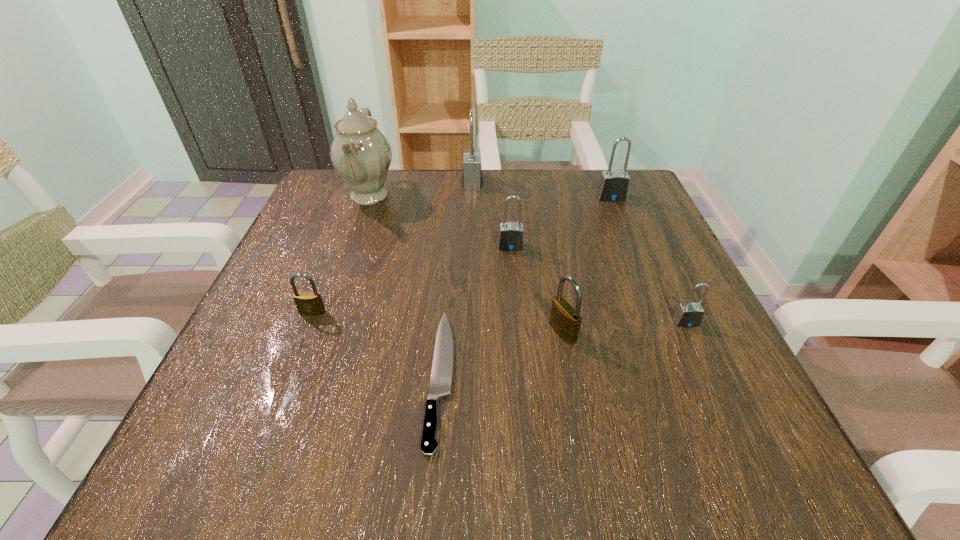
Where is `vacant region located 0.170m on the left of the steak knife`? The width and height of the screenshot is (960, 540). vacant region located 0.170m on the left of the steak knife is located at coordinates (317, 376).

Identify the location of chinaware at the far edge. (360, 153).

Find the location of `object present at the near edge`. object present at the near edge is located at coordinates (442, 367).

Locate an element on the screen. This screenshot has width=960, height=540. chinaware present at the left edge is located at coordinates (360, 153).

You are a GUI agent. You are given a task and a screenshot of the screen. Output one action in this format:
    pyautogui.click(x=<x>, y=<y>)
    Task: Click on the padlock present at the left edge
    
    Given the screenshot: What is the action you would take?
    pyautogui.click(x=308, y=303)

I want to click on object that is at the far left corner, so click(360, 153).

The width and height of the screenshot is (960, 540). I want to click on object that is at the far right corner, so click(613, 186).

The image size is (960, 540). Find the location of `vacant space at the far edge of the desktop`. vacant space at the far edge of the desktop is located at coordinates (435, 173).

Find the location of `free space at the left edge of the desktop`. free space at the left edge of the desktop is located at coordinates (268, 383).

Where is `vacant space at the right edge`? This screenshot has height=540, width=960. vacant space at the right edge is located at coordinates (593, 231).